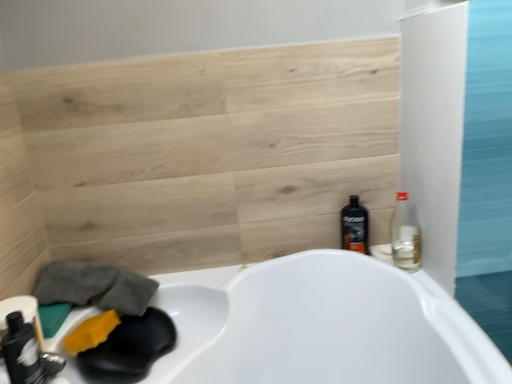
Question: Considering the positions of black plastic bottle at right, which ranks as the 2th bottle in right-to-left order, and matte black bottle at lower left, marked as the first bottle in a left-to-right arrangement, in the image, is black plastic bottle at right, which ranks as the 2th bottle in right-to-left order, wider or thinner than matte black bottle at lower left, marked as the first bottle in a left-to-right arrangement,?

Choices:
 (A) thin
 (B) wide

Answer: (A)

Question: Is point tap(343, 213) positioned closer to the camera than point tap(13, 360)?

Choices:
 (A) closer
 (B) farther

Answer: (B)

Question: Which of these objects is positioned closest to the yellow sponge at lower left?

Choices:
 (A) clear glass bottle at right, acting as the second bottle starting from the back
 (B) black plastic bottle at right, marked as the third bottle in a front-to-back arrangement
 (C) matte black bottle at lower left, which is the third bottle in back-to-front order

Answer: (C)

Question: Which of these objects is positioned farthest from the black plastic bottle at right, placed as the second bottle when sorted from left to right?

Choices:
 (A) clear glass bottle at right, acting as the second bottle starting from the back
 (B) matte black bottle at lower left, marked as the first bottle in a left-to-right arrangement
 (C) yellow sponge at lower left

Answer: (B)